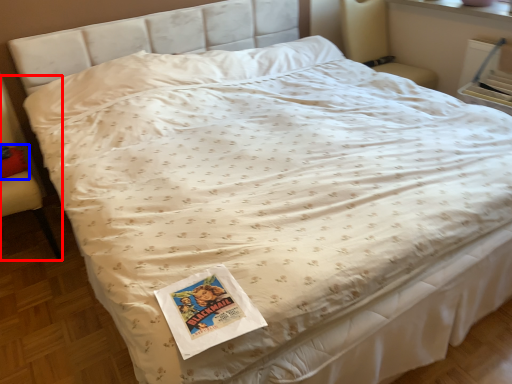
Question: Which object appears farthest to the camera in this image, armchair (highlighted by a red box) or pillow (highlighted by a blue box)?

Choices:
 (A) armchair
 (B) pillow

Answer: (B)